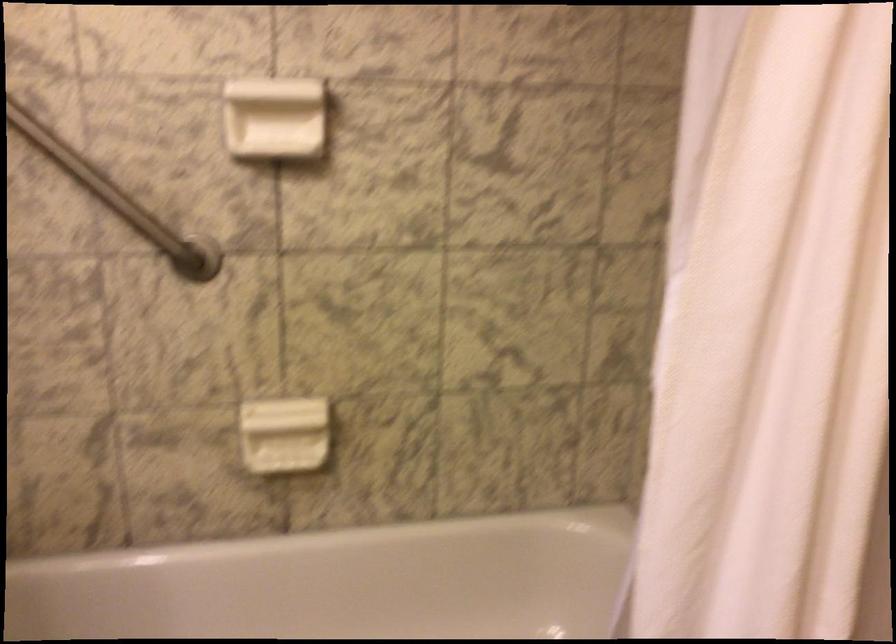
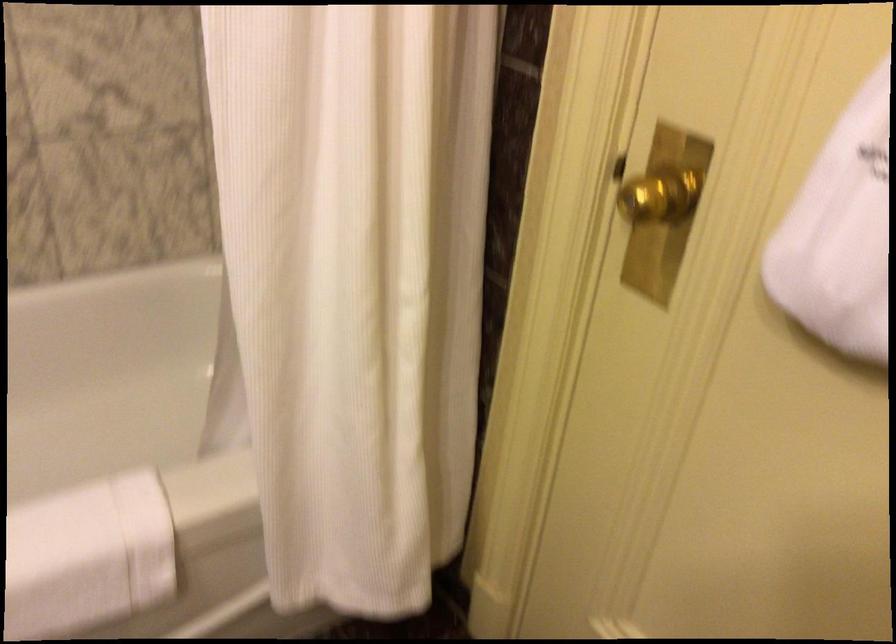
The first image is from the beginning of the video and the second image is from the end. How did the camera likely rotate when shooting the video?

The rotation direction of the camera is right-down.